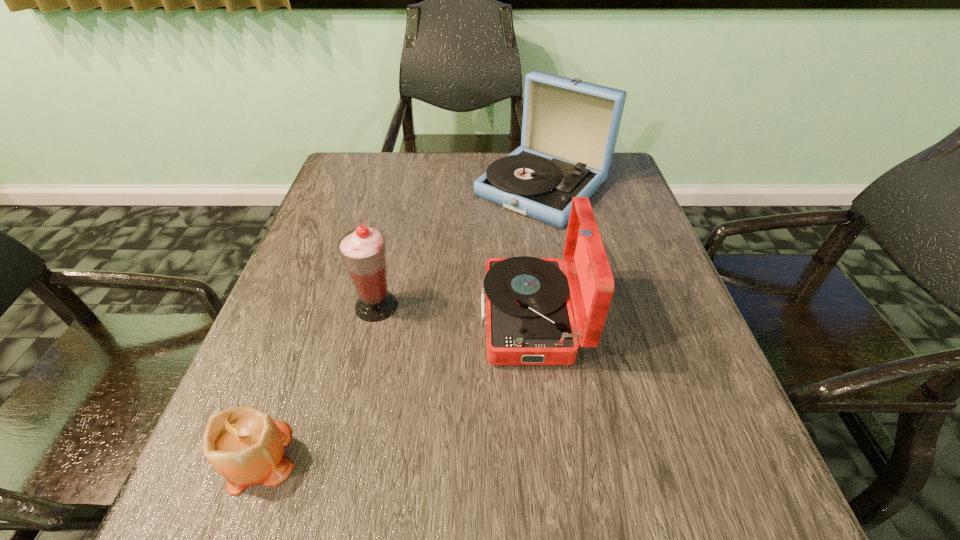
Identify the location of empty space between the shortest object and the farther phonograph_record. coord(399,322).

The image size is (960, 540). In order to click on vacant area between the farther phonograph_record and the nearer phonograph_record in this screenshot , I will do `click(537, 252)`.

The height and width of the screenshot is (540, 960). Find the location of `vacant space that is in between the second object from left to right and the nearer phonograph_record`. vacant space that is in between the second object from left to right and the nearer phonograph_record is located at coordinates (454, 312).

I want to click on free space between the nearer phonograph_record and the nearest object, so click(x=394, y=387).

Locate an element on the screen. This screenshot has height=540, width=960. unoccupied position between the candle and the nearer phonograph_record is located at coordinates (394, 387).

Locate which object ranks second in proximity to the candle. Please provide its 2D coordinates. Your answer should be formatted as a tuple, i.e. [(x, y)], where the tuple contains the x and y coordinates of a point satisfying the conditions above.

[(529, 321)]

In order to click on the second closest object to the smoothie in this screenshot , I will do `click(244, 445)`.

The width and height of the screenshot is (960, 540). In order to click on free location that satisfies the following two spatial constraints: 1. on the back side of the smoothie; 2. on the left side of the farther phonograph_record in this screenshot , I will do `click(403, 187)`.

Locate an element on the screen. This screenshot has width=960, height=540. free space that satisfies the following two spatial constraints: 1. on the back side of the smoothie; 2. on the left side of the farthest object is located at coordinates (403, 187).